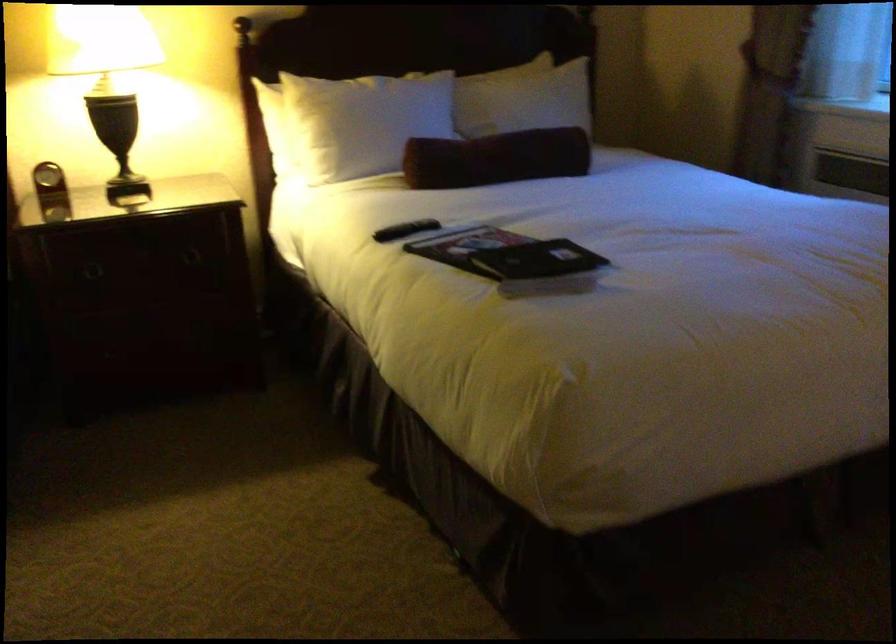
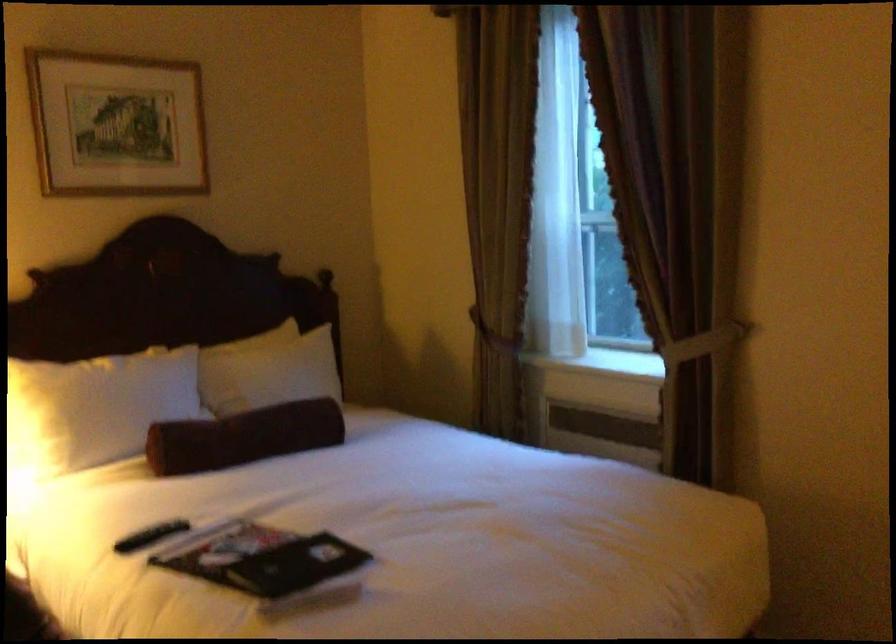
Where in the second image is the point corresponding to pixel 357 120 from the first image?

(95, 408)